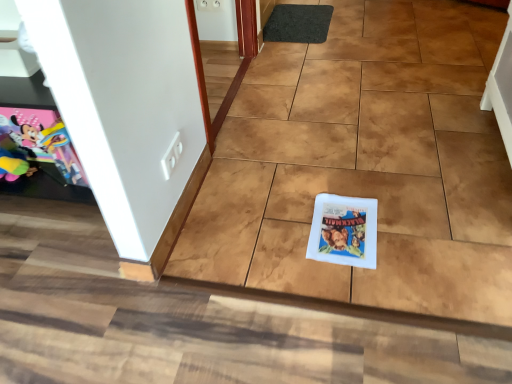
What are the coordinates of `free location above white paper comic book at center, which is the 1th comic book from bottom to top (from a real-world perspective)` in the screenshot? It's located at (344, 225).